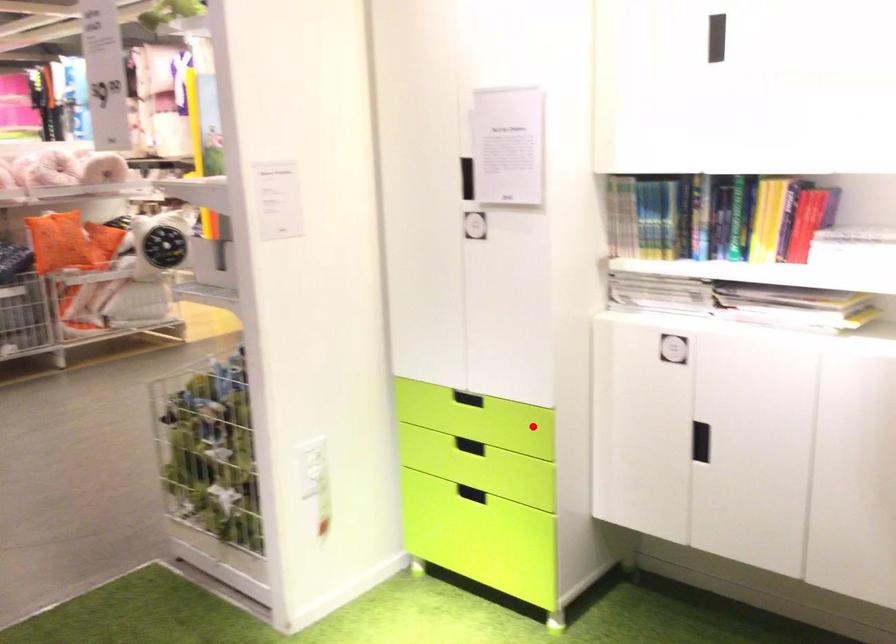
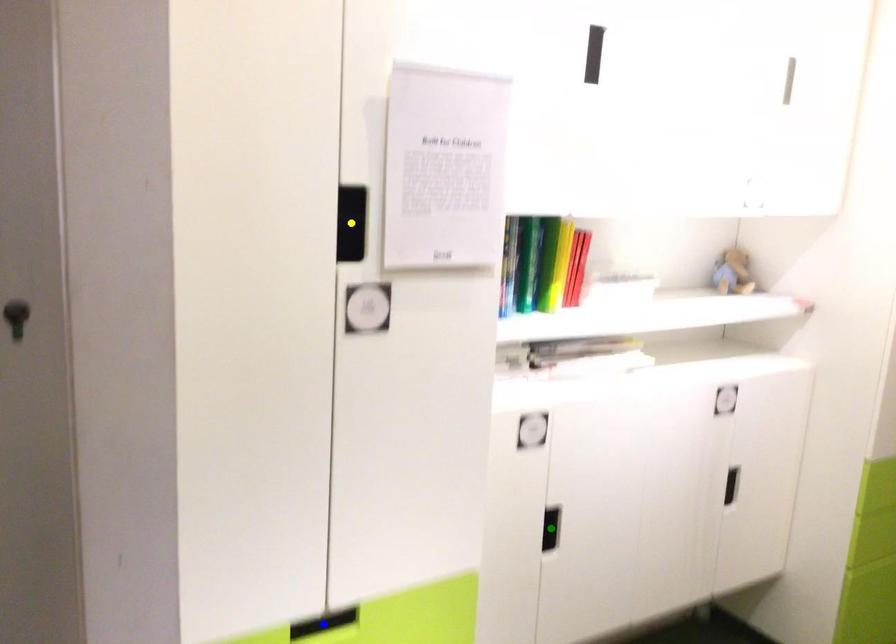
Question: I am providing you with two images of the same scene from different viewpoints. A red point is marked on the first image. You are given multiple points on the second image. Which mark in image 2 goes with the point in image 1?

Choices:
 (A) yellow point
 (B) green point
 (C) blue point

Answer: (C)